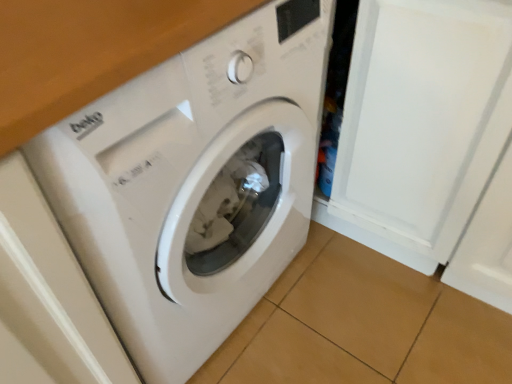
Describe the element at coordinates (194, 183) in the screenshot. I see `white glossy washing machine at center` at that location.

Identify the location of white glossy washing machine at center. (194, 183).

Locate an element on the screen. white glossy washing machine at center is located at coordinates (194, 183).